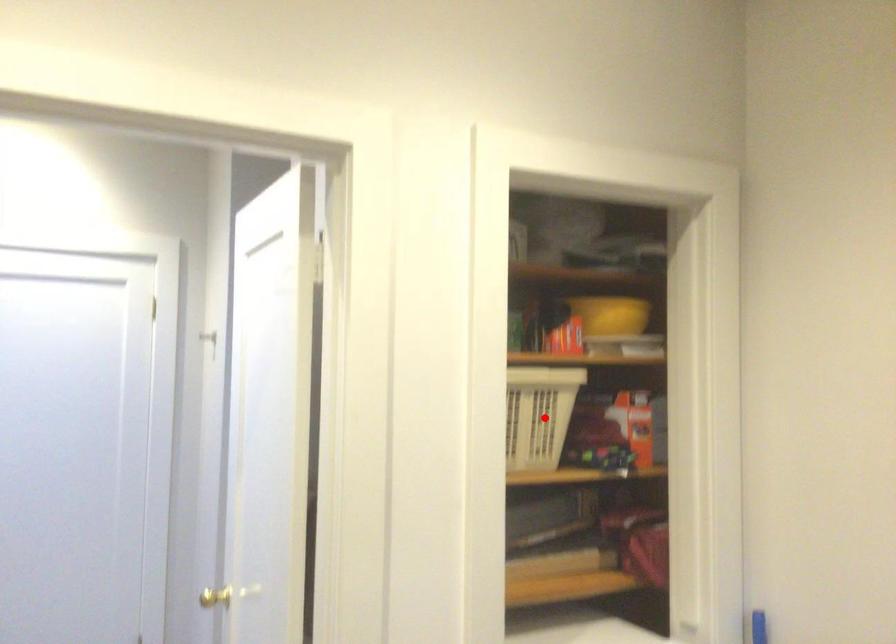
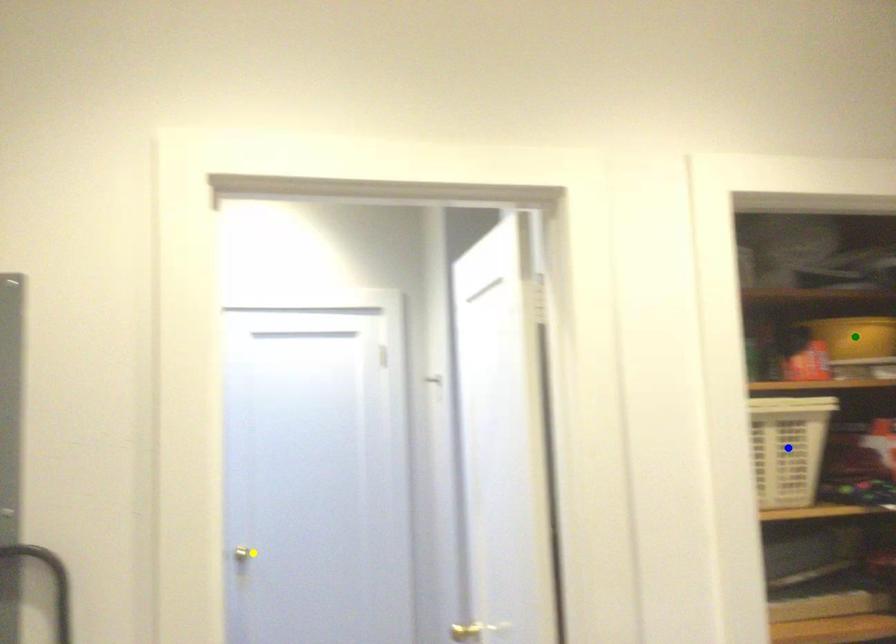
Question: I am providing you with two images of the same scene from different viewpoints. A red point is marked on the first image. You are given multiple points on the second image. In image 2, which mark is for the same physical point as the one in image 1?

Choices:
 (A) blue point
 (B) green point
 (C) yellow point

Answer: (A)